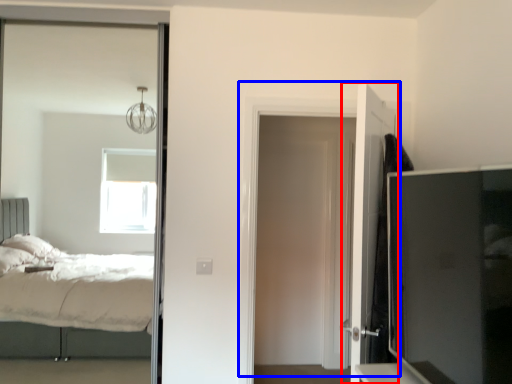
Question: Which of the following is the farthest to the observer, door (highlighted by a red box) or door (highlighted by a blue box)?

Choices:
 (A) door
 (B) door

Answer: (B)